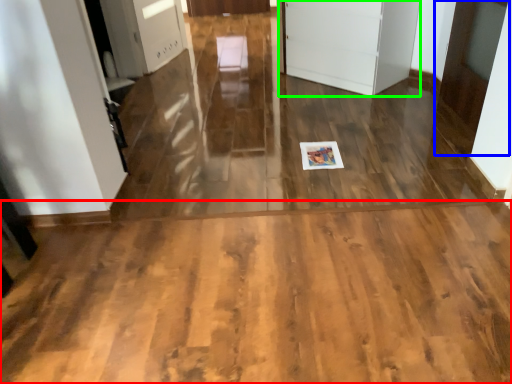
Question: Which is nearer to the corridor (highlighted by a red box)? door (highlighted by a blue box) or door (highlighted by a green box).

Choices:
 (A) door
 (B) door

Answer: (A)